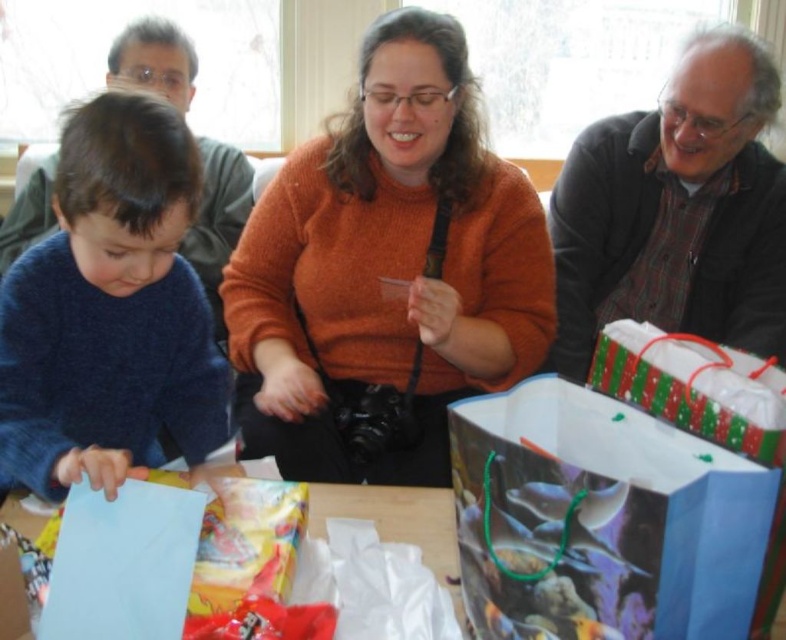
From the picture: You are helping organize gifts on a shelf. The green and white paper gift bag at right and the blue paper at lower left are both on the same shelf. Which one takes up more horizontal space?

The blue paper at lower left takes up more horizontal space because it has a greater width than the green and white paper gift bag at right.

You are a photographer standing in the scene. You want to take a photo of the blue paper at lower left without the orange sweater at center blocking it. Is it possible?

Answer: The orange sweater at center is above the blue paper at lower left, so it is blocking the view. To capture the blue paper at lower left without obstruction, you would need to adjust your angle or move the orange sweater at center out of the way.

You are a guest at a party and see the green and white paper gift bag at right and the blue paper at lower left. Which one is positioned more to the east side of the room?

The green and white paper gift bag at right is positioned more to the east side of the room because it is to the right of the blue paper at lower left.